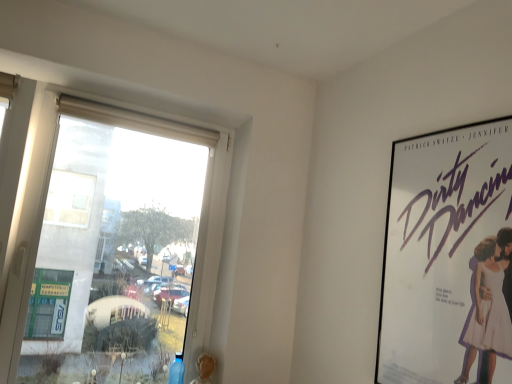
Question: Looking at their shapes, would you say transparent glass window at left is wider or thinner than white paper poster at right?

Choices:
 (A) wide
 (B) thin

Answer: (A)

Question: Is transparent glass window at left taller or shorter than white paper poster at right?

Choices:
 (A) short
 (B) tall

Answer: (B)

Question: From a real-world perspective, is transparent glass window at left positioned above or below white paper poster at right?

Choices:
 (A) below
 (B) above

Answer: (A)

Question: In terms of height, does white paper poster at right look taller or shorter compared to transparent glass window at left?

Choices:
 (A) short
 (B) tall

Answer: (A)

Question: Would you say white paper poster at right is to the left or to the right of transparent glass window at left in the picture?

Choices:
 (A) left
 (B) right

Answer: (B)

Question: Looking at the image, does white paper poster at right seem bigger or smaller compared to transparent glass window at left?

Choices:
 (A) big
 (B) small

Answer: (B)

Question: In terms of width, does white paper poster at right look wider or thinner when compared to transparent glass window at left?

Choices:
 (A) wide
 (B) thin

Answer: (B)